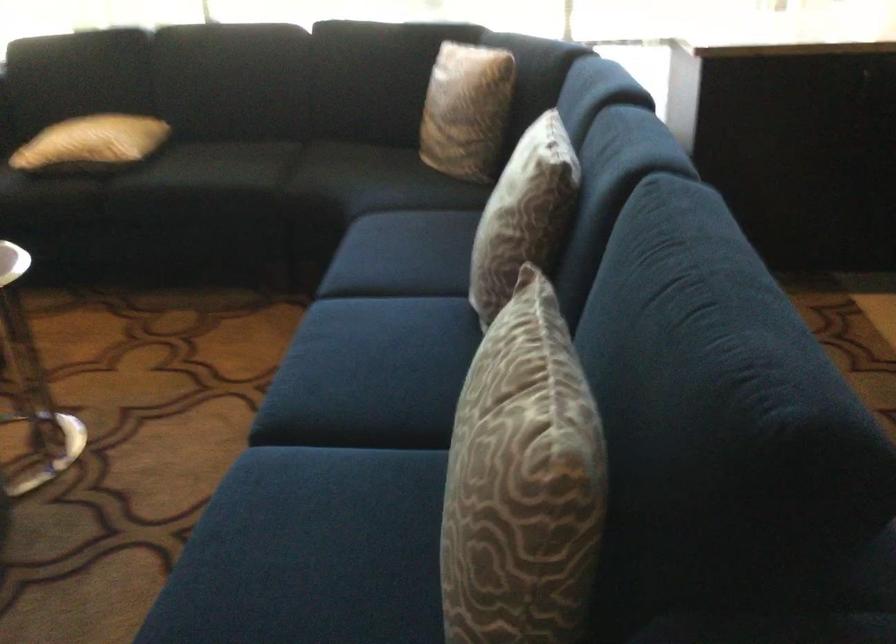
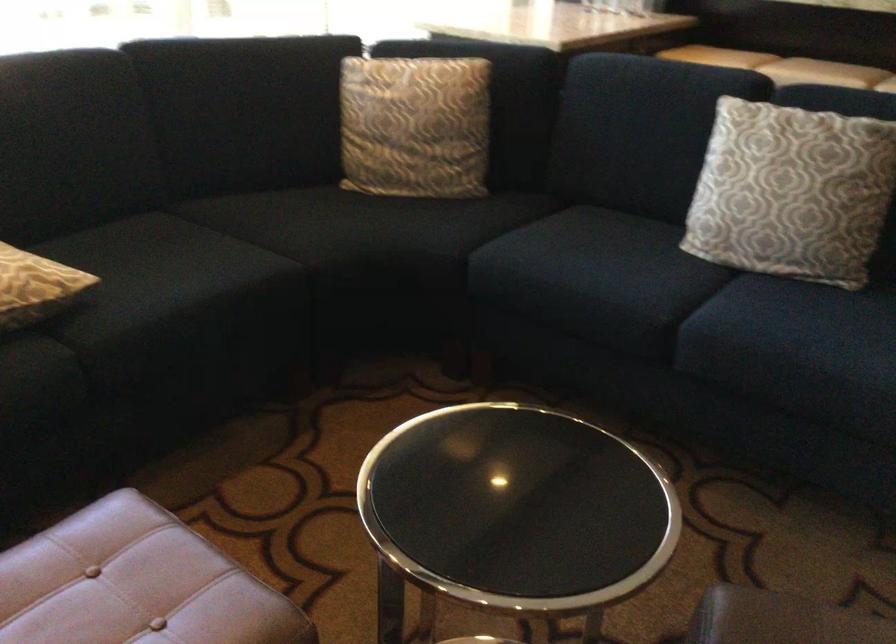
Where in the second image is the point corresponding to the point at 451,108 from the first image?

(415, 126)